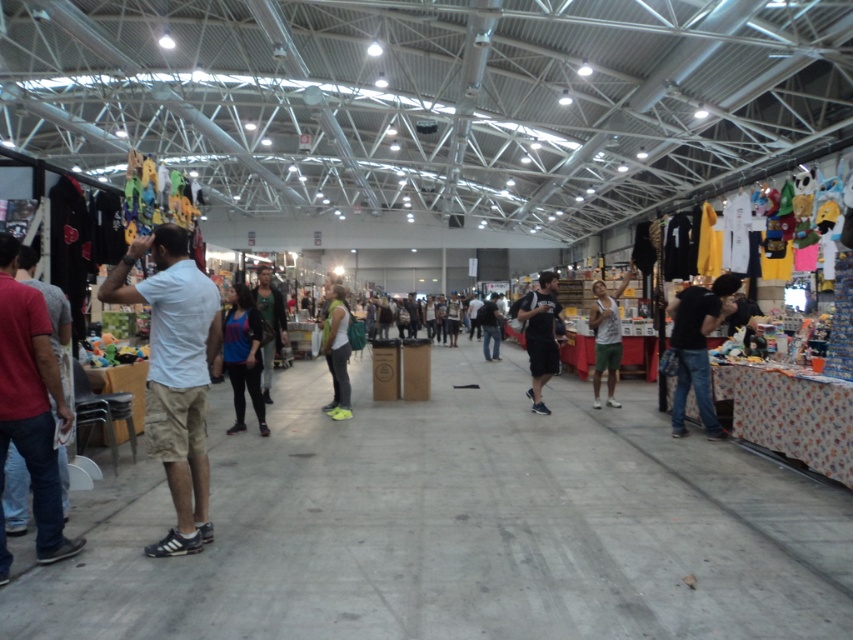
Question: Does blue fabric shirt at center have a lesser width compared to dark blue jeans at center?

Choices:
 (A) yes
 (B) no

Answer: (A)

Question: Is gray matte tank top at center-right closer to the viewer compared to green fabric backpack at center?

Choices:
 (A) yes
 (B) no

Answer: (B)

Question: Which of the following is the farthest from the observer?

Choices:
 (A) gray matte tank top at center-right
 (B) leather jacket at center

Answer: (A)

Question: Estimate the real-world distances between objects in this image. Which object is farther from the green fabric backpack at center?

Choices:
 (A) dark blue jeans at center
 (B) gray matte tank top at center-right
 (C) dark gray fabric backpack at center

Answer: (A)

Question: Can you confirm if white cotton shirt at left is bigger than blue fabric shirt at center?

Choices:
 (A) no
 (B) yes

Answer: (A)

Question: Which of these objects is positioned closest to the green fabric backpack at center?

Choices:
 (A) dark gray fabric backpack at center
 (B) blue fabric shirt at center
 (C) white cotton shirt at left

Answer: (B)